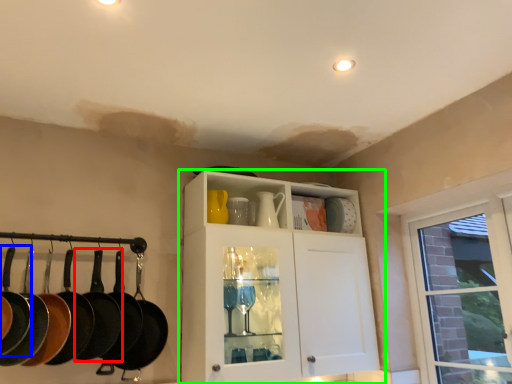
Question: Considering the real-world distances, which object is closest to frying pan (highlighted by a red box)? frying pan (highlighted by a blue box) or cabinetry (highlighted by a green box).

Choices:
 (A) frying pan
 (B) cabinetry

Answer: (A)